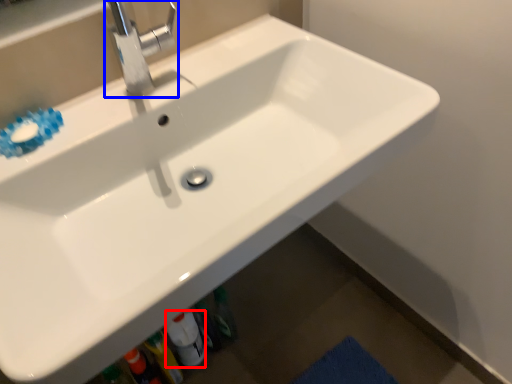
Question: Which object is closer to the camera taking this photo, bottle (highlighted by a red box) or tap (highlighted by a blue box)?

Choices:
 (A) bottle
 (B) tap

Answer: (B)